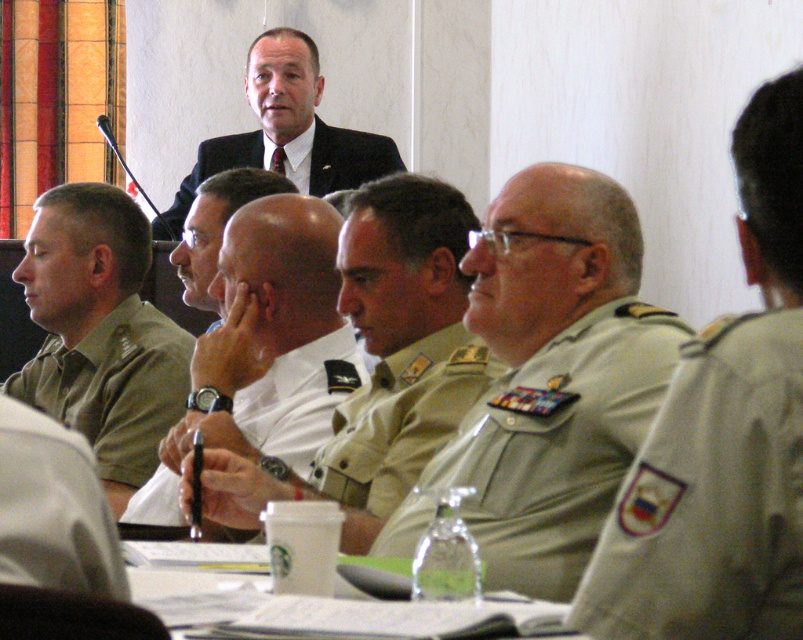
You are a photographer trying to capture a group photo of the attendees in the meeting. You need to ensure that both the white uniform at center and the khaki fabric uniform at center are clearly visible in the frame. Given their sizes, which uniform should you focus on to ensure both are in focus?

The white uniform at center is larger than the khaki fabric uniform at center, so focusing on the white uniform at center will ensure both uniforms are in focus as it is the larger and more prominent subject.

You are a participant in the meeting and need to locate two specific points marked in the room. The first point is at coordinates point (112, 241) and the second at point (483, 609). From your seated position at the table, which point is closer to you?

Point (483, 609) is closer to you because it is in front of point (112, 241), which is behind it.

You are a photographer positioned at the back of the room. You want to take a photo of the black suit at upper center and the green uniform at left. Which of these two will appear larger in the photo?

The green uniform at left will appear larger in the photo because it is closer to the viewer than the black suit at upper center.